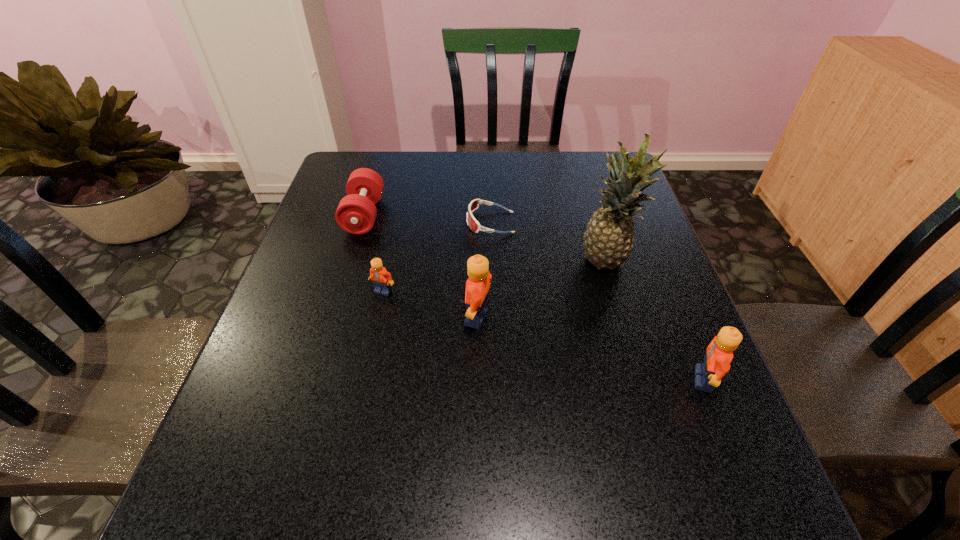
At what (x,y) coordinates should I click in order to perform the action: click on free space located 0.210m on the front-facing side of the goggles. Please return your answer as a coordinate pair (x, y). Looking at the image, I should click on (390, 222).

Image resolution: width=960 pixels, height=540 pixels. In order to click on vacant space located on the front-facing side of the goggles in this screenshot , I will do pyautogui.click(x=368, y=222).

Identify the location of object that is at the left edge. (356, 212).

Find the location of a particular element. Lego present at the right edge is located at coordinates (719, 353).

Find the location of a particular element. The width and height of the screenshot is (960, 540). pineapple that is at the right edge is located at coordinates (608, 239).

In the image, there is a desktop. At what (x,y) coordinates should I click in order to perform the action: click on vacant space at the far edge. Please return your answer as a coordinate pair (x, y). This screenshot has width=960, height=540. Looking at the image, I should click on (492, 185).

In the image, there is a desktop. What are the coordinates of `vacant area at the near edge` in the screenshot? It's located at (458, 451).

The height and width of the screenshot is (540, 960). In order to click on vacant space at the left edge in this screenshot , I will do `click(321, 292)`.

Image resolution: width=960 pixels, height=540 pixels. Find the location of `free space at the right edge of the desktop`. free space at the right edge of the desktop is located at coordinates (681, 404).

You are a GUI agent. You are given a task and a screenshot of the screen. Output one action in this format:
    pyautogui.click(x=<x>, y=<y>)
    Task: Click on the unoccupied area between the fifth object from left to right and the shortest Lego
    The width and height of the screenshot is (960, 540).
    Given the screenshot: What is the action you would take?
    pyautogui.click(x=495, y=276)